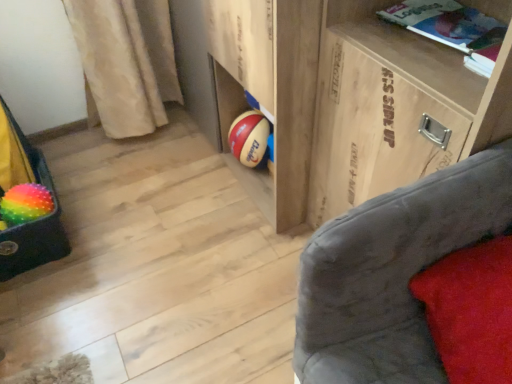
Question: Looking at their shapes, would you say rainbow rubber beach ball at lower left is wider or thinner than white paper book at upper right?

Choices:
 (A) wide
 (B) thin

Answer: (B)

Question: From a real-world perspective, is rainbow rubber beach ball at lower left physically located above or below white paper book at upper right?

Choices:
 (A) above
 (B) below

Answer: (B)

Question: Based on their relative distances, which object is nearer to the rainbow fuzzy bean bag chair at left?

Choices:
 (A) red velvet pillow at lower right
 (B) wooden at center
 (C) white paper book at upper right
 (D) rainbow rubber beach ball at lower left

Answer: (D)

Question: Which is farther from the rainbow rubber beach ball at lower left?

Choices:
 (A) wooden at center
 (B) red velvet pillow at lower right
 (C) white paper book at upper right
 (D) rainbow fuzzy bean bag chair at left

Answer: (C)